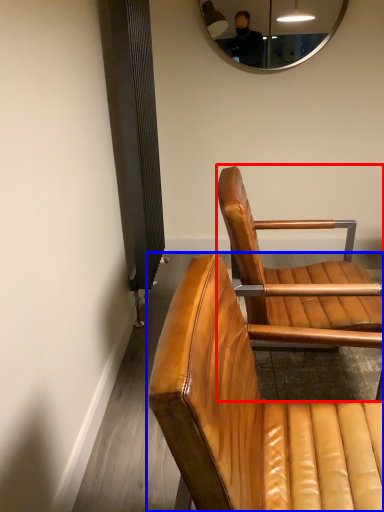
Question: Which point is further to the camera, chair (highlighted by a red box) or chair (highlighted by a blue box)?

Choices:
 (A) chair
 (B) chair

Answer: (A)